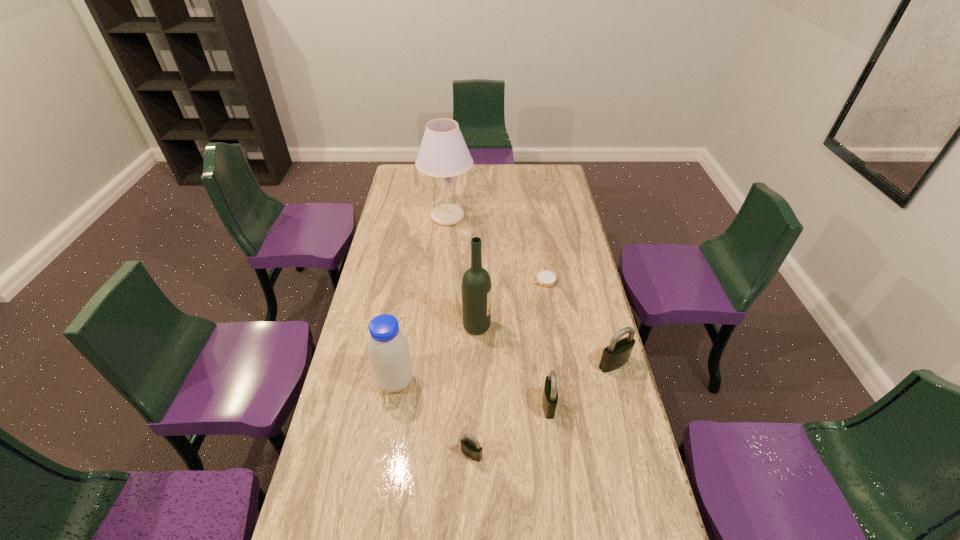
The width and height of the screenshot is (960, 540). I want to click on compass present at the right edge, so click(545, 278).

You are a GUI agent. You are given a task and a screenshot of the screen. Output one action in this format:
    pyautogui.click(x=<x>, y=<y>)
    Task: Click on the free space at the far edge of the desktop
    The height and width of the screenshot is (540, 960).
    Given the screenshot: What is the action you would take?
    pyautogui.click(x=516, y=170)

Locate an element on the screen. vacant space at the left edge of the desktop is located at coordinates (417, 201).

In the image, there is a desktop. In order to click on blank space at the right edge in this screenshot , I will do `click(571, 245)`.

At what (x,y) coordinates should I click in order to perform the action: click on free space at the near right corner of the desktop. Please return your answer as a coordinate pair (x, y). Looking at the image, I should click on (594, 522).

In order to click on unoccupied area between the compass and the leftmost padlock in this screenshot , I will do 508,367.

Identify the location of vacant region between the third tallest object and the wine bottle. Image resolution: width=960 pixels, height=540 pixels. (436, 354).

Find the location of a particular element. Image resolution: width=960 pixels, height=540 pixels. free point between the soya milk and the nearest padlock is located at coordinates (434, 418).

This screenshot has height=540, width=960. I want to click on free point between the soya milk and the rightmost object, so click(505, 373).

This screenshot has height=540, width=960. Identify the location of vacant space in between the second nearest padlock and the shortest padlock. (510, 429).